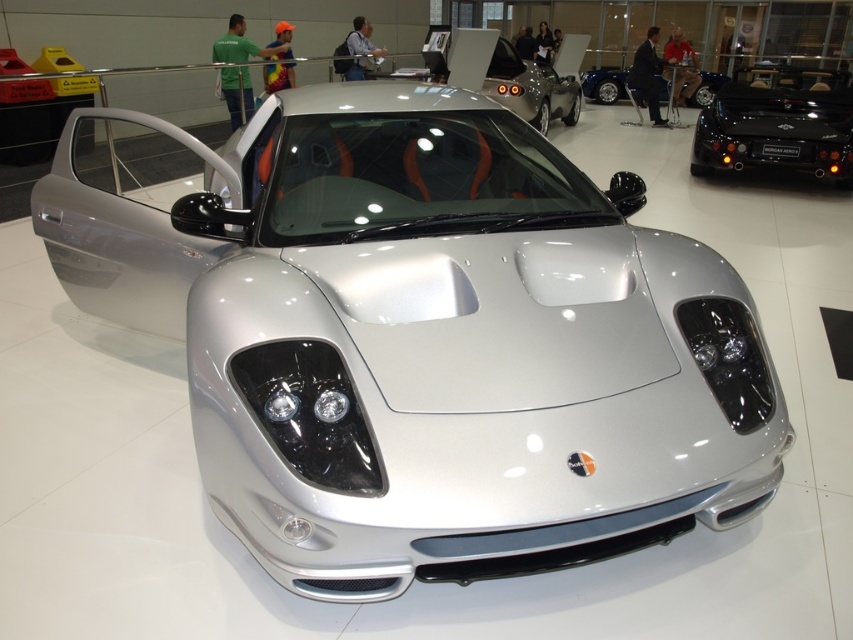
Question: Can you confirm if black glossy morgan aero at right is smaller than silver metallic sports car at center?

Choices:
 (A) no
 (B) yes

Answer: (B)

Question: Which of the following is the farthest from the observer?

Choices:
 (A) (762, 104)
 (B) (549, 67)

Answer: (B)

Question: In this image, where is black glossy morgan aero at right located relative to silver metallic sports car at center?

Choices:
 (A) above
 (B) below

Answer: (B)

Question: Which object is closer to the camera taking this photo?

Choices:
 (A) glossy blue car at upper center
 (B) silver metallic sports car at center

Answer: (B)

Question: Does silver metallic car at center have a larger size compared to black glossy morgan aero at right?

Choices:
 (A) no
 (B) yes

Answer: (B)

Question: Considering the real-world distances, which object is closest to the glossy blue car at upper center?

Choices:
 (A) black glossy morgan aero at right
 (B) silver metallic car at center

Answer: (A)